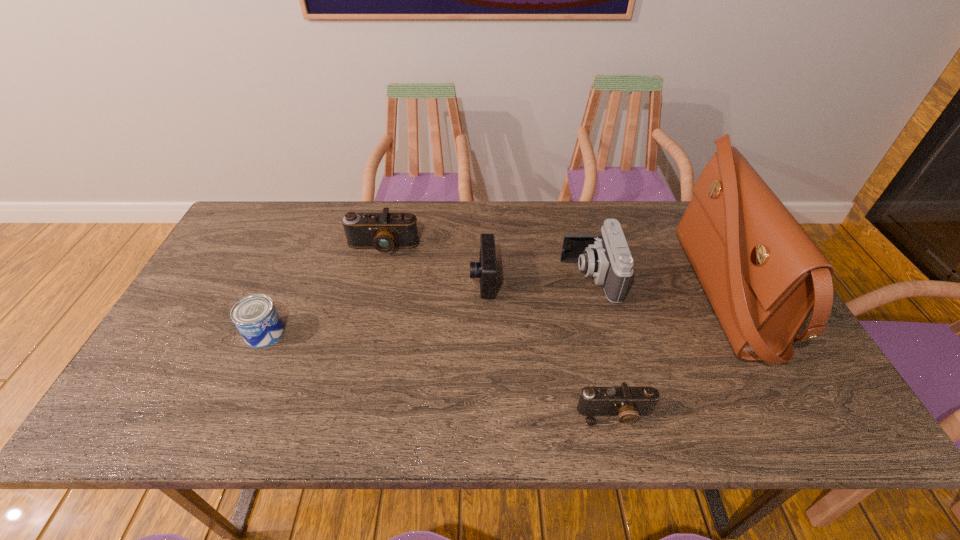
The width and height of the screenshot is (960, 540). Find the location of `the rightmost object`. the rightmost object is located at coordinates (763, 274).

Locate an element on the screen. the tallest object is located at coordinates (763, 274).

The width and height of the screenshot is (960, 540). In order to click on the fifth shortest object in this screenshot , I will do `click(606, 257)`.

Where is `the third object from left to right`? The image size is (960, 540). the third object from left to right is located at coordinates (486, 269).

The height and width of the screenshot is (540, 960). I want to click on the leftmost camera, so click(385, 231).

Locate an element on the screen. the leftmost object is located at coordinates (256, 317).

Where is `the shortest camera`? The width and height of the screenshot is (960, 540). the shortest camera is located at coordinates (628, 403).

Locate an element on the screen. This screenshot has width=960, height=540. the nearest object is located at coordinates (628, 403).

I want to click on vacant space located 0.160m on the front flap of the satchel, so click(628, 294).

Find the location of a particular element. This screenshot has width=960, height=540. free space located on the front flap of the satchel is located at coordinates (570, 294).